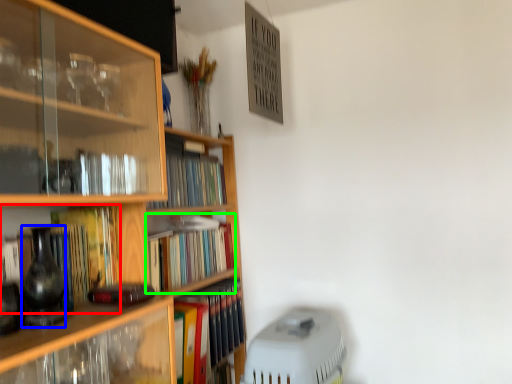
Question: Based on their relative distances, which object is farther from book (highlighted by a red box)? Choose from glass vase (highlighted by a blue box) and book (highlighted by a green box).

Choices:
 (A) glass vase
 (B) book

Answer: (B)